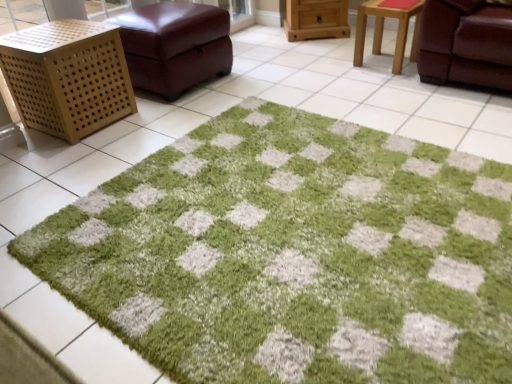
What is the approximate width of wooden stool at upper right?

It is 13.87 inches.

The height and width of the screenshot is (384, 512). I want to click on wooden cabinet at upper center, the 3th furniture viewed from the left, so click(x=315, y=19).

This screenshot has height=384, width=512. What do you see at coordinates (315, 19) in the screenshot?
I see `wooden cabinet at upper center, which ranks as the 1th furniture in right-to-left order` at bounding box center [315, 19].

Measure the distance between point (x=229, y=16) and camera.

A distance of 9.11 feet exists between point (x=229, y=16) and camera.

Find the location of a particular element. green shaggy rug at center is located at coordinates (294, 255).

Is wooden lattice cube at left, marked as the first furniture in a left-to-right arrangement, to the right of wooden stool at upper right from the viewer's perspective?

In fact, wooden lattice cube at left, marked as the first furniture in a left-to-right arrangement, is to the left of wooden stool at upper right.

Can wooden stool at upper right be found inside wooden lattice cube at left, the 3th furniture in the right-to-left sequence?

No, wooden stool at upper right is not surrounded by wooden lattice cube at left, the 3th furniture in the right-to-left sequence.

Considering the positions of point (105, 42) and point (394, 64), is point (105, 42) closer or farther from the camera than point (394, 64)?

Point (105, 42) is positioned closer to the camera compared to point (394, 64).

From the image's perspective, is leather ottoman at upper left, the 2th furniture in the right-to-left sequence, located above or below green shaggy rug at center?

leather ottoman at upper left, the 2th furniture in the right-to-left sequence, is above green shaggy rug at center.

Is point (135, 42) less distant than point (249, 148)?

No, (135, 42) is behind (249, 148).

Which object is closer to the camera taking this photo, leather ottoman at upper left, the 2th furniture in the right-to-left sequence, or green shaggy rug at center?

green shaggy rug at center.

Looking at this image, is leather ottoman at upper left, placed as the 2th furniture when sorted from left to right, at the left side of green shaggy rug at center?

Correct, you'll find leather ottoman at upper left, placed as the 2th furniture when sorted from left to right, to the left of green shaggy rug at center.

Between wooden cabinet at upper center, the 3th furniture viewed from the left, and wooden lattice cube at left, the 3th furniture in the right-to-left sequence, which one has larger width?

wooden lattice cube at left, the 3th furniture in the right-to-left sequence.

Image resolution: width=512 pixels, height=384 pixels. Find the location of `furniture that is the 2nd one when counting leftward from the wooden cabinet at upper center, which ranks as the 1th furniture in right-to-left order`. furniture that is the 2nd one when counting leftward from the wooden cabinet at upper center, which ranks as the 1th furniture in right-to-left order is located at coordinates (67, 77).

How many degrees apart are the facing directions of wooden cabinet at upper center, which ranks as the 1th furniture in right-to-left order, and wooden lattice cube at left, the 3th furniture in the right-to-left sequence?

53.4 degrees.

How distant is wooden cabinet at upper center, which ranks as the 1th furniture in right-to-left order, from wooden lattice cube at left, marked as the first furniture in a left-to-right arrangement?

wooden cabinet at upper center, which ranks as the 1th furniture in right-to-left order, is 6.21 feet from wooden lattice cube at left, marked as the first furniture in a left-to-right arrangement.

Considering the sizes of objects wooden stool at upper right and wooden cabinet at upper center, the 3th furniture viewed from the left, in the image provided, who is bigger, wooden stool at upper right or wooden cabinet at upper center, the 3th furniture viewed from the left,?

wooden cabinet at upper center, the 3th furniture viewed from the left.

Is wooden stool at upper right shorter than wooden cabinet at upper center, the 3th furniture viewed from the left?

No.

In the image, is wooden stool at upper right positioned in front of or behind wooden cabinet at upper center, which ranks as the 1th furniture in right-to-left order?

wooden stool at upper right is in front of wooden cabinet at upper center, which ranks as the 1th furniture in right-to-left order.

How many degrees apart are the facing directions of wooden stool at upper right and wooden cabinet at upper center, which ranks as the 1th furniture in right-to-left order?

40.9 degrees separate the facing orientations of wooden stool at upper right and wooden cabinet at upper center, which ranks as the 1th furniture in right-to-left order.

Looking at this image, is leather ottoman at upper left, the 2th furniture in the right-to-left sequence, inside or outside of wooden lattice cube at left, marked as the first furniture in a left-to-right arrangement?

leather ottoman at upper left, the 2th furniture in the right-to-left sequence, exists outside the volume of wooden lattice cube at left, marked as the first furniture in a left-to-right arrangement.

Considering the positions of objects leather ottoman at upper left, placed as the 2th furniture when sorted from left to right, and wooden lattice cube at left, marked as the first furniture in a left-to-right arrangement, in the image provided, who is more to the left, leather ottoman at upper left, placed as the 2th furniture when sorted from left to right, or wooden lattice cube at left, marked as the first furniture in a left-to-right arrangement,?

wooden lattice cube at left, marked as the first furniture in a left-to-right arrangement.

In order to click on the 1st furniture positioned above the wooden lattice cube at left, the 3th furniture in the right-to-left sequence (from the image's perspective) in this screenshot , I will do `click(175, 45)`.

From a real-world perspective, does leather ottoman at upper left, the 2th furniture in the right-to-left sequence, sit lower than wooden lattice cube at left, marked as the first furniture in a left-to-right arrangement?

Actually, leather ottoman at upper left, the 2th furniture in the right-to-left sequence, is physically above wooden lattice cube at left, marked as the first furniture in a left-to-right arrangement, in the real world.

Which is behind, point (498, 348) or point (134, 19)?

The point (134, 19) is behind.

Can you tell me how much green shaggy rug at center and leather ottoman at upper left, the 2th furniture in the right-to-left sequence, differ in facing direction?

The angle between the facing direction of green shaggy rug at center and the facing direction of leather ottoman at upper left, the 2th furniture in the right-to-left sequence, is 90.4 degrees.

Are green shaggy rug at center and leather ottoman at upper left, the 2th furniture in the right-to-left sequence, far apart?

Indeed, green shaggy rug at center is not near leather ottoman at upper left, the 2th furniture in the right-to-left sequence.

Which object is further away from the camera, green shaggy rug at center or leather ottoman at upper left, placed as the 2th furniture when sorted from left to right?

Positioned behind is leather ottoman at upper left, placed as the 2th furniture when sorted from left to right.

What's the angular difference between leather ottoman at upper left, placed as the 2th furniture when sorted from left to right, and wooden stool at upper right's facing directions?

91.7 degrees separate the facing orientations of leather ottoman at upper left, placed as the 2th furniture when sorted from left to right, and wooden stool at upper right.

Is leather ottoman at upper left, placed as the 2th furniture when sorted from left to right, beside wooden stool at upper right?

No, leather ottoman at upper left, placed as the 2th furniture when sorted from left to right, is not beside wooden stool at upper right.

From the picture: Between leather ottoman at upper left, the 2th furniture in the right-to-left sequence, and wooden stool at upper right, which one has larger size?

leather ottoman at upper left, the 2th furniture in the right-to-left sequence, is bigger.

Between leather ottoman at upper left, placed as the 2th furniture when sorted from left to right, and wooden stool at upper right, which one is positioned behind?

wooden stool at upper right is more distant.

You are a GUI agent. You are given a task and a screenshot of the screen. Output one action in this format:
    pyautogui.click(x=<x>, y=<y>)
    Task: Click on the furniture that is the 2nd one when counting downward from the wooden stool at upper right (from the image's perspective)
    The height and width of the screenshot is (384, 512).
    Given the screenshot: What is the action you would take?
    pyautogui.click(x=67, y=77)

The image size is (512, 384). Find the location of `bath mat lying on the right of leather ottoman at upper left, placed as the 2th furniture when sorted from left to right`. bath mat lying on the right of leather ottoman at upper left, placed as the 2th furniture when sorted from left to right is located at coordinates (294, 255).

From the image, which object appears to be farther from wooden stool at upper right, wooden cabinet at upper center, the 3th furniture viewed from the left, or leather ottoman at upper left, the 2th furniture in the right-to-left sequence?

leather ottoman at upper left, the 2th furniture in the right-to-left sequence, lies further to wooden stool at upper right than the other object.

Considering their positions, is wooden lattice cube at left, marked as the first furniture in a left-to-right arrangement, positioned closer to wooden stool at upper right than wooden cabinet at upper center, the 3th furniture viewed from the left?

Based on the image, wooden cabinet at upper center, the 3th furniture viewed from the left, appears to be nearer to wooden stool at upper right.

Based on their spatial positions, is wooden cabinet at upper center, the 3th furniture viewed from the left, or wooden lattice cube at left, marked as the first furniture in a left-to-right arrangement, further from green shaggy rug at center?

wooden cabinet at upper center, the 3th furniture viewed from the left, is further to green shaggy rug at center.

Looking at the image, which one is located further to green shaggy rug at center, leather ottoman at upper left, placed as the 2th furniture when sorted from left to right, or wooden cabinet at upper center, which ranks as the 1th furniture in right-to-left order?

Based on the image, wooden cabinet at upper center, which ranks as the 1th furniture in right-to-left order, appears to be further to green shaggy rug at center.

Based on their spatial positions, is green shaggy rug at center or wooden stool at upper right further from leather ottoman at upper left, the 2th furniture in the right-to-left sequence?

Based on the image, green shaggy rug at center appears to be further to leather ottoman at upper left, the 2th furniture in the right-to-left sequence.

Estimate the real-world distances between objects in this image. Which object is further from wooden stool at upper right, green shaggy rug at center or leather ottoman at upper left, the 2th furniture in the right-to-left sequence?

Based on the image, green shaggy rug at center appears to be further to wooden stool at upper right.

When comparing their distances from green shaggy rug at center, does wooden stool at upper right or wooden cabinet at upper center, which ranks as the 1th furniture in right-to-left order, seem closer?

wooden stool at upper right is positioned closer to the anchor green shaggy rug at center.

Consider the image. Which object lies nearer to the anchor point wooden cabinet at upper center, the 3th furniture viewed from the left, leather ottoman at upper left, placed as the 2th furniture when sorted from left to right, or wooden stool at upper right?

The object closer to wooden cabinet at upper center, the 3th furniture viewed from the left, is wooden stool at upper right.

You are a GUI agent. You are given a task and a screenshot of the screen. Output one action in this format:
    pyautogui.click(x=<x>, y=<y>)
    Task: Click on the bath mat between wooden lattice cube at left, the 3th furniture in the right-to-left sequence, and wooden stool at upper right from left to right
    The image size is (512, 384).
    Given the screenshot: What is the action you would take?
    pyautogui.click(x=294, y=255)

Identify the location of furniture located between green shaggy rug at center and leather ottoman at upper left, the 2th furniture in the right-to-left sequence, in the depth direction. (67, 77).

I want to click on table located between green shaggy rug at center and wooden cabinet at upper center, the 3th furniture viewed from the left, in the depth direction, so click(x=383, y=29).

At what (x,y) coordinates should I click in order to perform the action: click on furniture situated between wooden lattice cube at left, marked as the first furniture in a left-to-right arrangement, and wooden cabinet at upper center, which ranks as the 1th furniture in right-to-left order, from left to right. Please return your answer as a coordinate pair (x, y). Looking at the image, I should click on (175, 45).